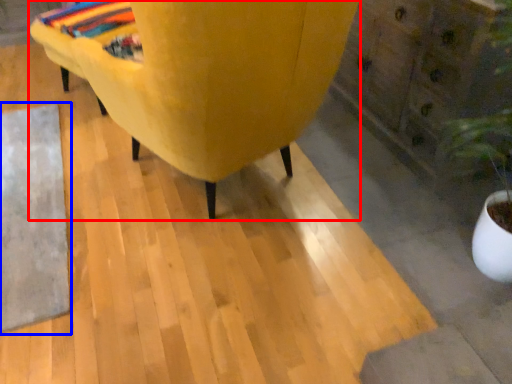
Question: Which point is further to the camera, furniture (highlighted by a red box) or mat (highlighted by a blue box)?

Choices:
 (A) furniture
 (B) mat

Answer: (B)